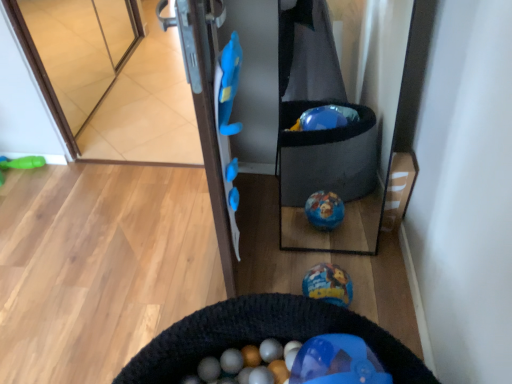
Question: In terms of height, does transparent glass door at upper left look taller or shorter compared to black knitted cat bed at lower center?

Choices:
 (A) short
 (B) tall

Answer: (B)

Question: Is transparent glass door at upper left to the left or to the right of black knitted cat bed at lower center in the image?

Choices:
 (A) left
 (B) right

Answer: (A)

Question: Estimate the real-world distances between objects in this image. Which object is closer to the transparent glass door at upper left?

Choices:
 (A) black knitted cat bed at lower center
 (B) green rubber toy at left, which appears as the 1th toy when viewed from the top
 (C) shiny metallic ball at center, which is the first toy from bottom to top

Answer: (B)

Question: Estimate the real-world distances between objects in this image. Which object is closer to the shiny metallic ball at center, the second toy from the back?

Choices:
 (A) black knitted cat bed at lower center
 (B) transparent glass door at upper left
 (C) green rubber toy at left, marked as the 1th toy in a left-to-right arrangement

Answer: (A)